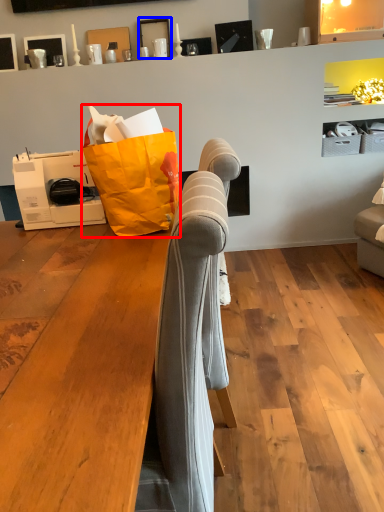
Question: Which of the following is the farthest to the observer, grocery bag (highlighted by a red box) or picture frame (highlighted by a blue box)?

Choices:
 (A) grocery bag
 (B) picture frame

Answer: (B)